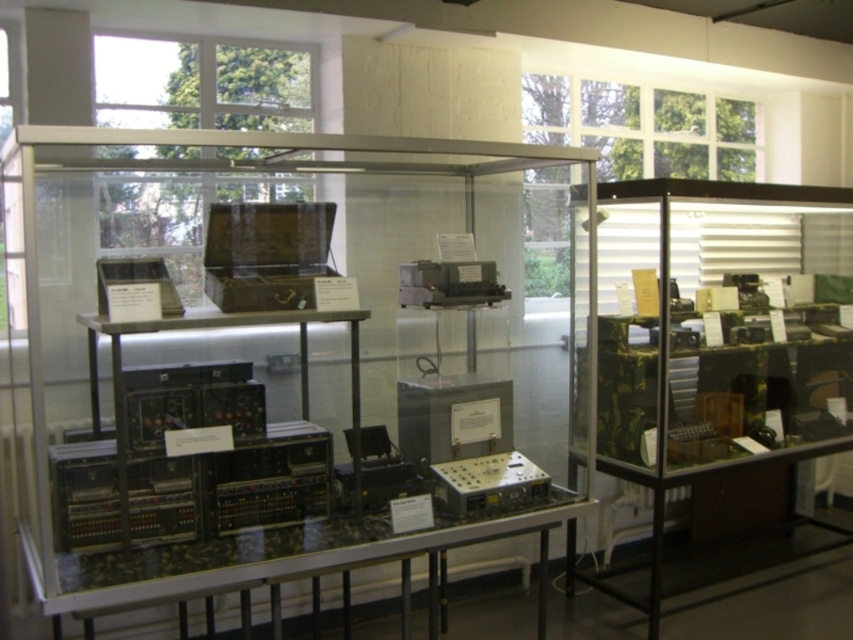
Is camouflage fabric electronics at right above metallic silver electronic device at center?

Indeed, camouflage fabric electronics at right is positioned over metallic silver electronic device at center.

How much distance is there between camouflage fabric electronics at right and metallic silver electronic device at center?

A distance of 4.05 feet exists between camouflage fabric electronics at right and metallic silver electronic device at center.

Which is behind, point (737, 360) or point (438, 496)?

Positioned behind is point (737, 360).

Image resolution: width=853 pixels, height=640 pixels. Find the location of `camouflage fabric electronics at right`. camouflage fabric electronics at right is located at coordinates [720, 336].

How much distance is there between clear acrylic glass box at center and metallic silver electronic device at center?

clear acrylic glass box at center is 22.88 inches away from metallic silver electronic device at center.

Who is more forward, (x=289, y=400) or (x=456, y=483)?

Point (x=456, y=483)

Image resolution: width=853 pixels, height=640 pixels. I want to click on clear acrylic glass box at center, so click(x=274, y=380).

Based on the photo, does clear acrylic glass box at center have a lesser width compared to camouflage fabric electronics at right?

No, clear acrylic glass box at center is not thinner than camouflage fabric electronics at right.

From the picture: Is clear acrylic glass box at center to the right of camouflage fabric electronics at right from the viewer's perspective?

In fact, clear acrylic glass box at center is to the left of camouflage fabric electronics at right.

Locate an element on the screen. This screenshot has height=640, width=853. clear acrylic glass box at center is located at coordinates (274, 380).